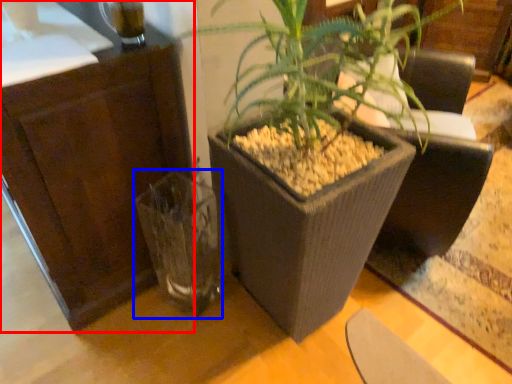
Question: Among these objects, which one is farthest to the camera, dresser (highlighted by a red box) or vase (highlighted by a blue box)?

Choices:
 (A) dresser
 (B) vase

Answer: (B)